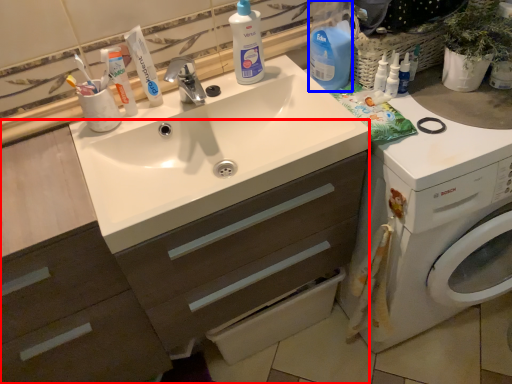
Question: Which point is closer to the camera, dresser (highlighted by a red box) or cleaning product (highlighted by a blue box)?

Choices:
 (A) dresser
 (B) cleaning product

Answer: (A)